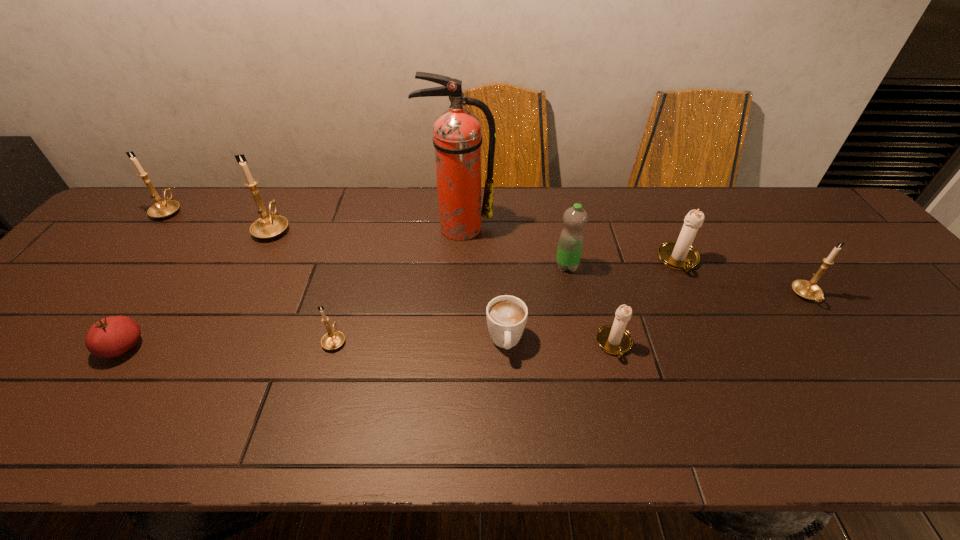
Find the location of a particular element. The image size is (960, 540). the tallest object is located at coordinates (457, 139).

What are the coordinates of `the biggest gold candle holder` in the screenshot? It's located at (268, 226).

I want to click on the second tallest object, so click(x=268, y=226).

Where is `the leftmost candle holder`? the leftmost candle holder is located at coordinates (x=162, y=209).

Identify the location of the fifth shortest candle holder. (162, 209).

Where is `green water bottle`? The width and height of the screenshot is (960, 540). green water bottle is located at coordinates (575, 218).

Identify the location of water bottle. (575, 218).

In order to click on the rightmost gold candle holder in this screenshot , I will do `click(808, 290)`.

You are a GUI agent. You are given a task and a screenshot of the screen. Output one action in this format:
    pyautogui.click(x=<x>, y=<y>)
    Task: Click on the fifth nearest object
    The width and height of the screenshot is (960, 540).
    Given the screenshot: What is the action you would take?
    pyautogui.click(x=808, y=290)

Where is `the fourth nearest candle holder`? Image resolution: width=960 pixels, height=540 pixels. the fourth nearest candle holder is located at coordinates (680, 255).